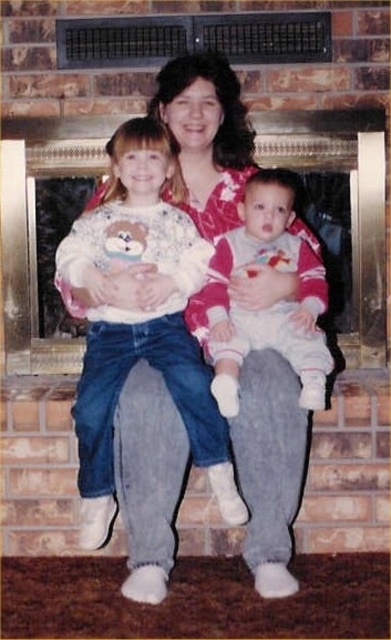
Question: Is white fleece sweater at center above white soft baby at center?

Choices:
 (A) yes
 (B) no

Answer: (B)

Question: Which point is closer to the camera taking this photo?

Choices:
 (A) (82, 268)
 (B) (299, 260)

Answer: (A)

Question: From the image, what is the correct spatial relationship of white fleece sweater at center in relation to white soft baby at center?

Choices:
 (A) below
 (B) above

Answer: (A)

Question: Can you confirm if white fleece sweater at center is positioned to the right of white soft baby at center?

Choices:
 (A) no
 (B) yes

Answer: (A)

Question: Which object is closer to the camera taking this photo?

Choices:
 (A) white soft baby at center
 (B) white fleece sweater at center

Answer: (B)

Question: Among these objects, which one is farthest from the camera?

Choices:
 (A) white soft baby at center
 (B) white fleece sweater at center

Answer: (A)